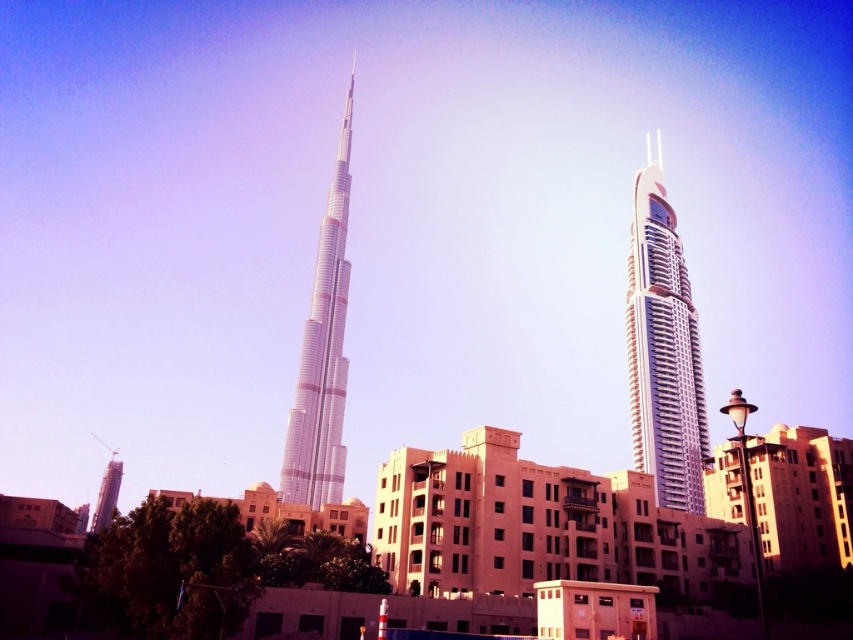
You are standing at the base of the Burj Khalifa and want to walk towards the Address Downtown Dubai Hotel. There are two points marked on the ground ahead of you, point A at coordinates point A is point (677, 456) and point B at coordinates point B is point (335, 259). Which point is closer to you as you face the Address Downtown Dubai Hotel?

Point A at coordinates point A is point (677, 456) is closer to you because it is in front of point B at coordinates point B is point (335, 259), meaning it is nearer to your current position at the base of the Burj Khalifa.

You are a drone operator planning to fly a drone between the shiny glass skyscraper at right and the silver metallic tower at center. Based on the scene, can you determine if the space between them is wide enough for your drone to pass through safely?

The shiny glass skyscraper at right might be wider than silver metallic tower at center, so the space between them may not be wide enough for the drone to pass safely. Further verification is needed.

You are a drone operator planning to fly a drone from the point marked at coordinates point [663,348]. Your goal is to reach the Burj Khalifa. Which direction should you fly the drone to reach the Burj Khalifa?

The point [663,348] corresponds to the shiny glass skyscraper at right. The Burj Khalifa is located to the left of this building, so you should fly the drone to the left to reach the Burj Khalifa.